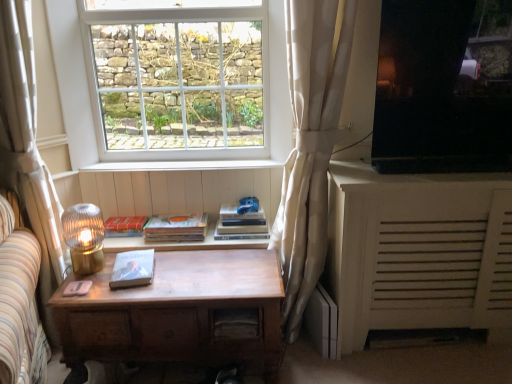
Question: Is white textured curtain at center, placed as the second curtain when sorted from left to right, positioned with its back to hardcover book at center?

Choices:
 (A) yes
 (B) no

Answer: (B)

Question: Can you confirm if white textured curtain at center, the first curtain viewed from the right, is wider than hardcover book at center?

Choices:
 (A) yes
 (B) no

Answer: (A)

Question: Is white textured curtain at center, placed as the second curtain when sorted from left to right, at the left side of hardcover book at center?

Choices:
 (A) no
 (B) yes

Answer: (A)

Question: Is white textured curtain at center, placed as the second curtain when sorted from left to right, in front of hardcover book at center?

Choices:
 (A) no
 (B) yes

Answer: (B)

Question: From a real-world perspective, is white textured curtain at center, the first curtain viewed from the right, physically below hardcover book at center?

Choices:
 (A) no
 (B) yes

Answer: (A)

Question: Is white wood at center spatially inside white textured cabinet at right, or outside of it?

Choices:
 (A) outside
 (B) inside

Answer: (A)

Question: Is white wood at center in front of or behind white textured cabinet at right in the image?

Choices:
 (A) behind
 (B) front

Answer: (A)

Question: In terms of size, does white wood at center appear bigger or smaller than white textured cabinet at right?

Choices:
 (A) small
 (B) big

Answer: (A)

Question: From a real-world perspective, is white wood at center positioned above or below white textured cabinet at right?

Choices:
 (A) above
 (B) below

Answer: (A)

Question: Choose the correct answer: Is matte red paperback book at center, which is the 3th paperback book in front-to-back order, inside white wood at center or outside it?

Choices:
 (A) outside
 (B) inside

Answer: (A)

Question: Looking at their shapes, would you say matte red paperback book at center, which is counted as the 1th paperback book, starting from the back, is wider or thinner than white wood at center?

Choices:
 (A) wide
 (B) thin

Answer: (A)

Question: In the image, is matte red paperback book at center, which is the 3th paperback book in front-to-back order, on the left side or the right side of white wood at center?

Choices:
 (A) right
 (B) left

Answer: (B)

Question: Is point (135, 223) positioned closer to the camera than point (203, 168)?

Choices:
 (A) closer
 (B) farther

Answer: (A)

Question: Is point (54, 314) closer or farther from the camera than point (284, 71)?

Choices:
 (A) farther
 (B) closer

Answer: (B)

Question: From a real-world perspective, is wooden desk at center physically located above or below white glass window at upper center?

Choices:
 (A) above
 (B) below

Answer: (B)